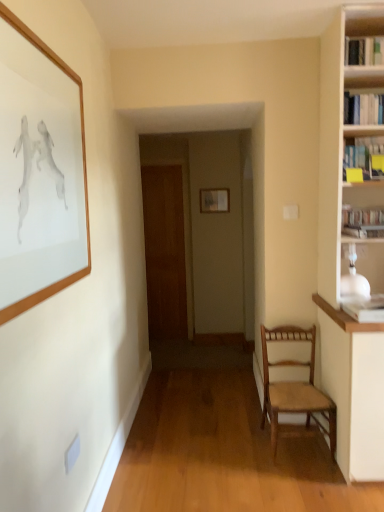
You are a GUI agent. You are given a task and a screenshot of the screen. Output one action in this format:
    pyautogui.click(x=<x>, y=<y>)
    Task: Click on the free point below hardcover book at upper right, positioned as the first book in top-to-bottom order (from a real-world perspective)
    Image resolution: width=384 pixels, height=512 pixels.
    Given the screenshot: What is the action you would take?
    pyautogui.click(x=370, y=82)